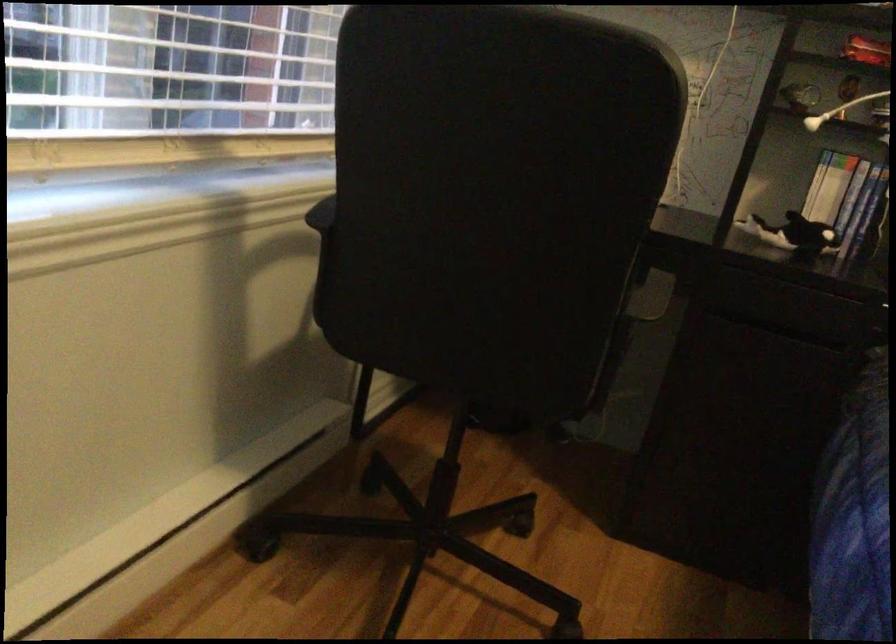
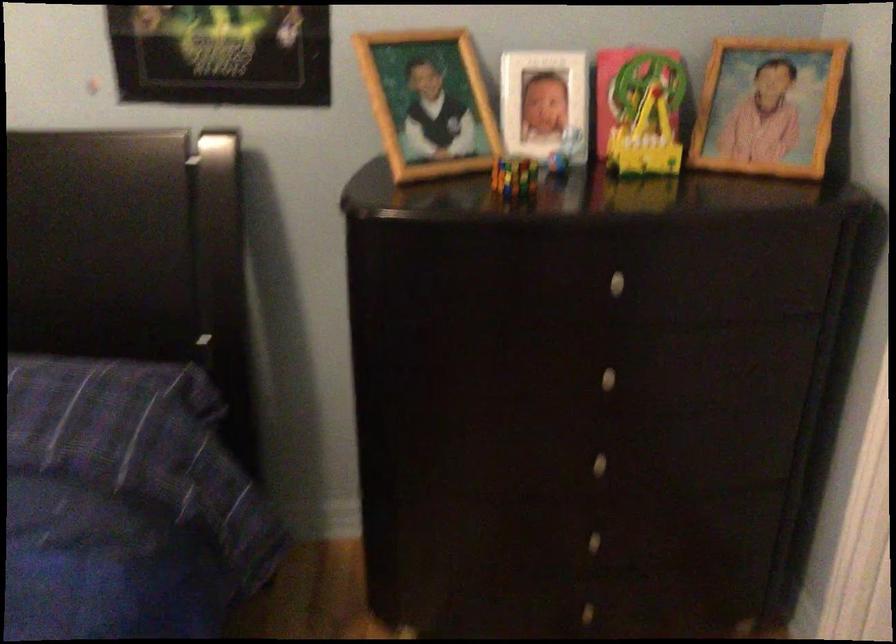
Question: What movement of the cameraman would produce the second image?

Choices:
 (A) Left
 (B) Right
 (C) Forward
 (D) Backward

Answer: (B)